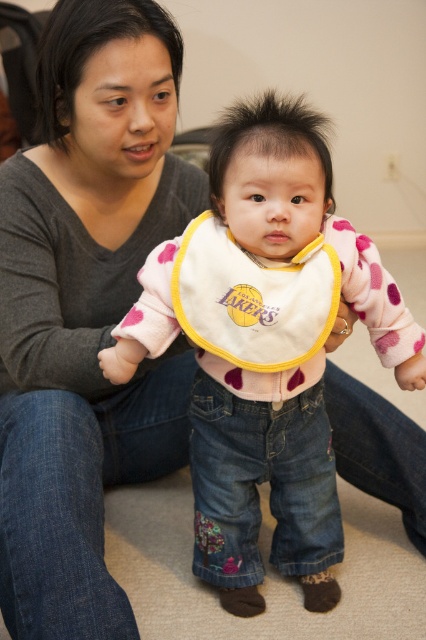
Is matte gray sweater at center to the left of pink fleece bib at center from the viewer's perspective?

Correct, you'll find matte gray sweater at center to the left of pink fleece bib at center.

Describe the element at coordinates (86, 310) in the screenshot. The image size is (426, 640). I see `matte gray sweater at center` at that location.

Does point (109, 236) come in front of point (362, 307)?

No, it is not.

The image size is (426, 640). In order to click on matte gray sweater at center in this screenshot , I will do `click(86, 310)`.

Which is above, matte gray sweater at center or white/yellow fabric bib at center?

Positioned higher is white/yellow fabric bib at center.

Who is taller, matte gray sweater at center or white/yellow fabric bib at center?

matte gray sweater at center is taller.

Is point (103, 326) less distant than point (201, 241)?

No, it is not.

This screenshot has width=426, height=640. I want to click on matte gray sweater at center, so (86, 310).

This screenshot has height=640, width=426. What do you see at coordinates (264, 348) in the screenshot?
I see `pink fleece bib at center` at bounding box center [264, 348].

Who is positioned more to the left, pink fleece bib at center or white/yellow fabric bib at center?

white/yellow fabric bib at center

The width and height of the screenshot is (426, 640). What are the coordinates of `pink fleece bib at center` in the screenshot? It's located at (264, 348).